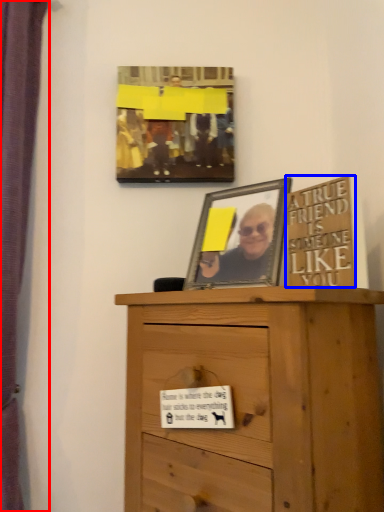
Question: Which object appears farthest to the camera in this image, curtain (highlighted by a red box) or writing (highlighted by a blue box)?

Choices:
 (A) curtain
 (B) writing

Answer: (A)